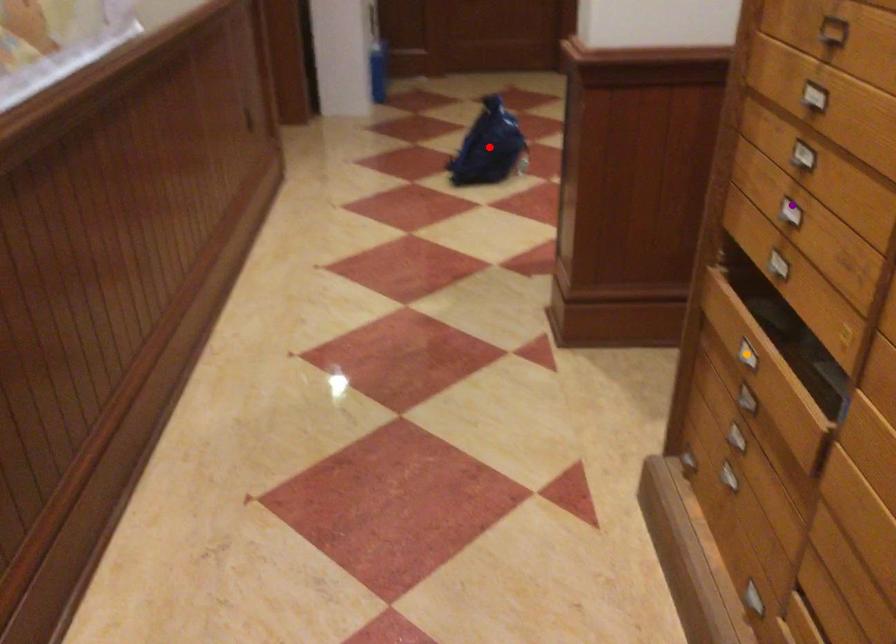
Consider the image. Order these from nearest to farthest:
red point | purple point | orange point

red point < orange point < purple point